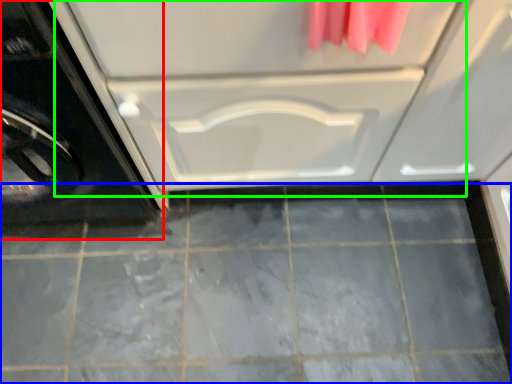
Question: Which object is positioned farthest from washing machine (highlighted by a red box)? Select from ceramic tile (highlighted by a blue box) and drawer (highlighted by a green box).

Choices:
 (A) ceramic tile
 (B) drawer

Answer: (A)